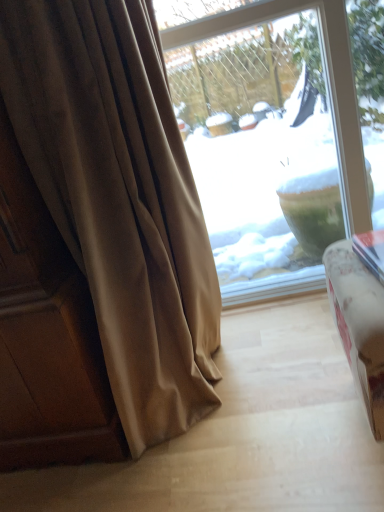
The width and height of the screenshot is (384, 512). Find the location of `vacant space underneath brown silk curtain at left (from a real-world perspective)`. vacant space underneath brown silk curtain at left (from a real-world perspective) is located at coordinates (219, 399).